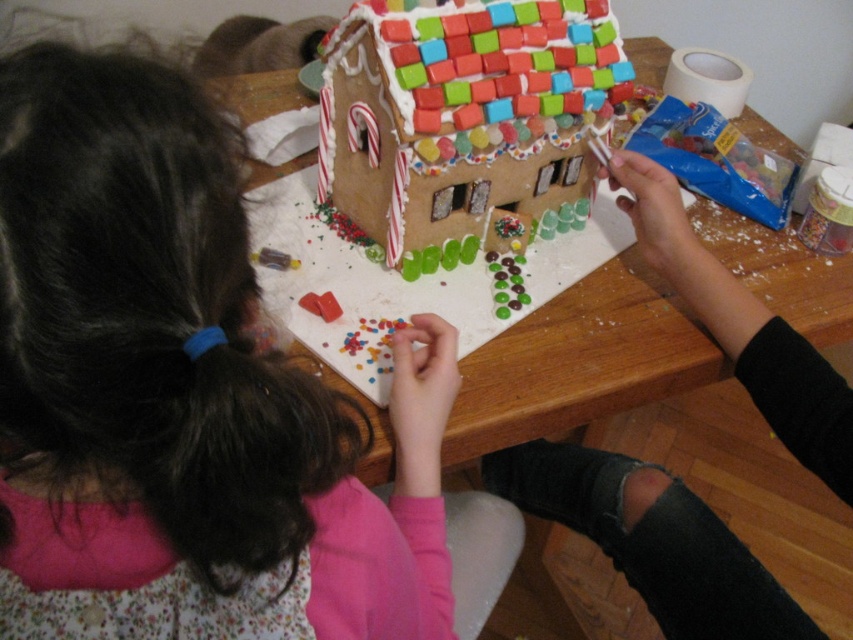
Can you confirm if matte pink shirt at center is positioned to the left of wooden table at center?

Correct, you'll find matte pink shirt at center to the left of wooden table at center.

Does matte pink shirt at center appear on the right side of wooden table at center?

No, matte pink shirt at center is not to the right of wooden table at center.

This screenshot has width=853, height=640. Describe the element at coordinates (169, 390) in the screenshot. I see `matte pink shirt at center` at that location.

You are a GUI agent. You are given a task and a screenshot of the screen. Output one action in this format:
    pyautogui.click(x=<x>, y=<y>)
    Task: Click on the matte pink shirt at center
    This screenshot has height=640, width=853.
    Given the screenshot: What is the action you would take?
    pyautogui.click(x=169, y=390)